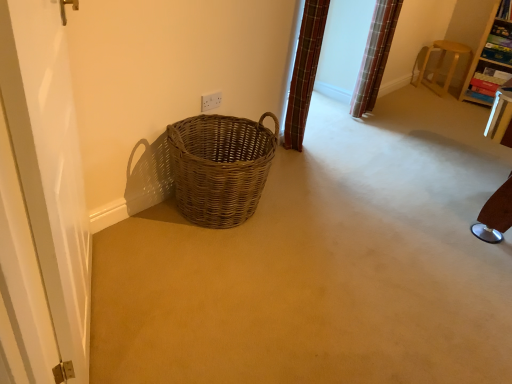
I want to click on vacant area to the right of white glossy screen door at left, so click(197, 308).